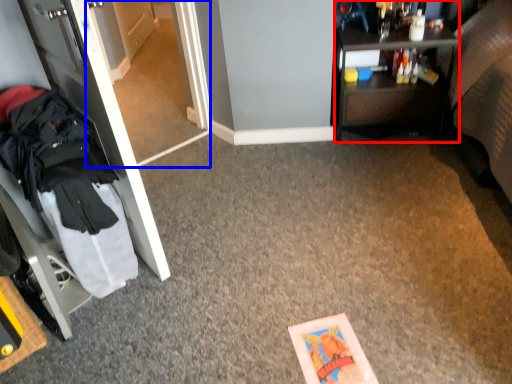
Question: Which point is closer to the camera, desk (highlighted by a red box) or glass door (highlighted by a blue box)?

Choices:
 (A) desk
 (B) glass door

Answer: (B)